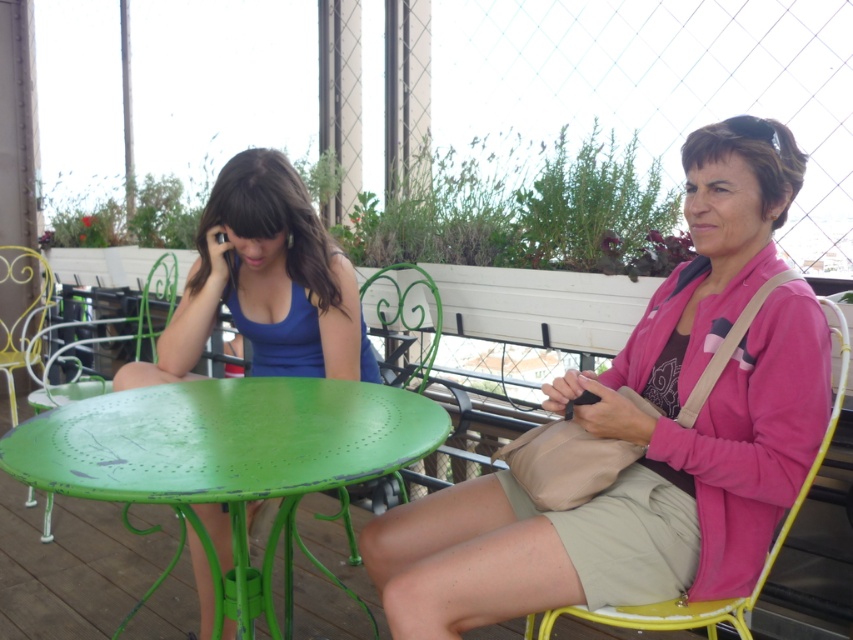
Question: Among these objects, which one is farthest from the camera?

Choices:
 (A) blue matte tank top at center
 (B) pink fabric jacket at upper right
 (C) green painted metal table at center

Answer: (A)

Question: Does green painted metal table at center have a greater width compared to blue matte tank top at center?

Choices:
 (A) no
 (B) yes

Answer: (B)

Question: Can you confirm if pink fabric jacket at upper right is positioned to the right of blue matte tank top at center?

Choices:
 (A) no
 (B) yes

Answer: (B)

Question: Is green painted metal table at center bigger than yellow metal chair at right?

Choices:
 (A) no
 (B) yes

Answer: (B)

Question: Which point is closer to the camera taking this photo?

Choices:
 (A) (233, 419)
 (B) (694, 349)

Answer: (B)

Question: Among these points, which one is farthest from the camera?

Choices:
 (A) (751, 166)
 (B) (119, 417)

Answer: (B)